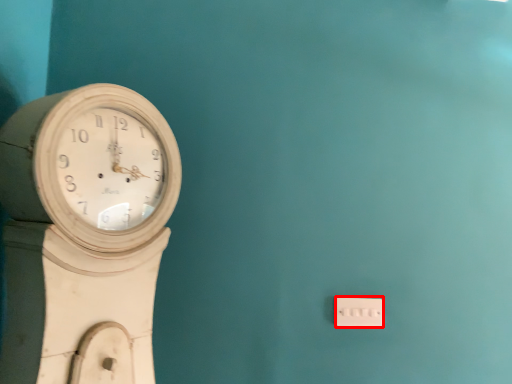
Question: Observing the image, what is the correct spatial positioning of electric outlet (annotated by the red box) in reference to wall clock?

Choices:
 (A) right
 (B) left

Answer: (A)